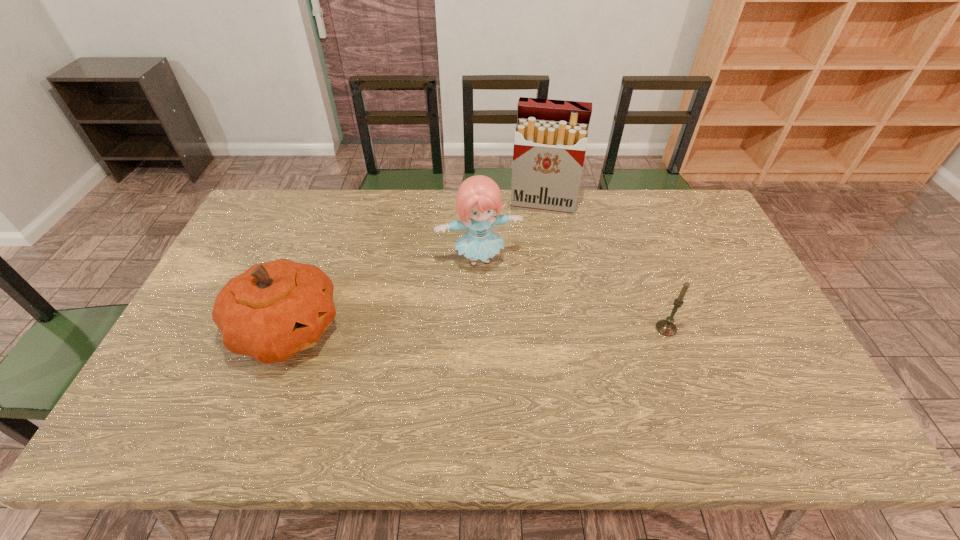
Where is `free spot between the rightmost object and the cigarette case`? This screenshot has width=960, height=540. free spot between the rightmost object and the cigarette case is located at coordinates (605, 266).

You are a GUI agent. You are given a task and a screenshot of the screen. Output one action in this format:
    pyautogui.click(x=<x>, y=<y>)
    Task: Click on the vacant space that's between the doll and the second shortest object
    
    Given the screenshot: What is the action you would take?
    pyautogui.click(x=383, y=295)

The height and width of the screenshot is (540, 960). I want to click on vacant space that is in between the leftmost object and the candle, so click(x=476, y=329).

Identify the location of free space between the third tallest object and the farthest object. (415, 267).

Point out which object is positioned as the second nearest to the third nearest object. Please provide its 2D coordinates. Your answer should be formatted as a tuple, i.e. [(x, y)], where the tuple contains the x and y coordinates of a point satisfying the conditions above.

[(272, 311)]

Find the location of `object that can be found as the third closest to the third shortest object`. object that can be found as the third closest to the third shortest object is located at coordinates tap(666, 327).

At what (x,y) coordinates should I click in order to perform the action: click on vacant point that satisfies the following two spatial constraints: 1. on the front side of the candle; 2. on the right side of the doll. Please return your answer as a coordinate pair (x, y). This screenshot has height=540, width=960. Looking at the image, I should click on (479, 328).